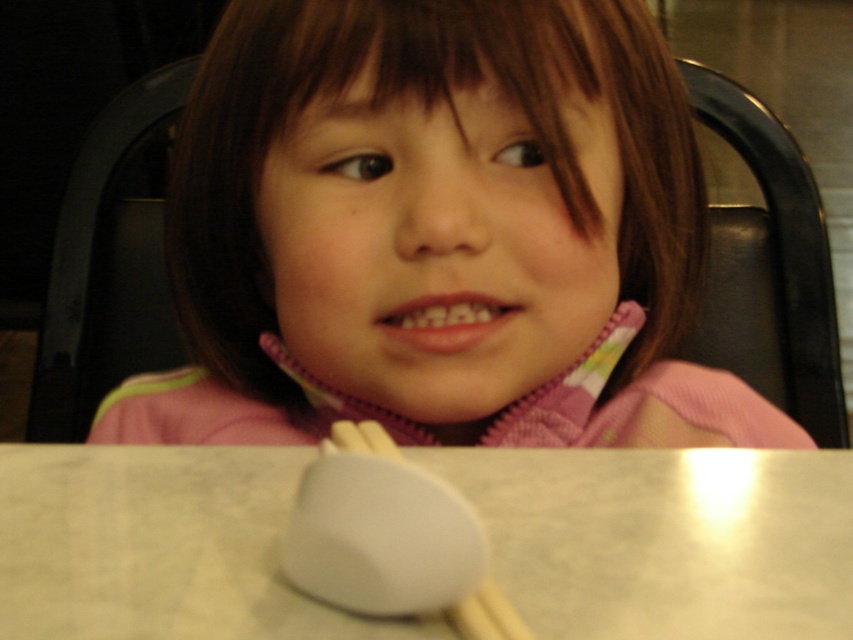
You are a photographer trying to capture a close shot of the child. The camera is positioned at a certain distance from the point labeled as point (614,145). If the recommended distance for a close shot is between 15 to 20 inches, is the current distance within the recommended range?

The distance between point (614,145) and the camera is 18.71 inches, which falls within the recommended range of 15 to 20 inches for a close shot.

You are a photographer setting up a shoot. You need to position a small lamp between the pink fleece at center and the black leather chair at upper right. Based on their positions, where should you place the lamp?

The lamp should be placed between the pink fleece at center and the black leather chair at upper right, to the right of the pink fleece at center since it is to the left of the black leather chair at upper right.